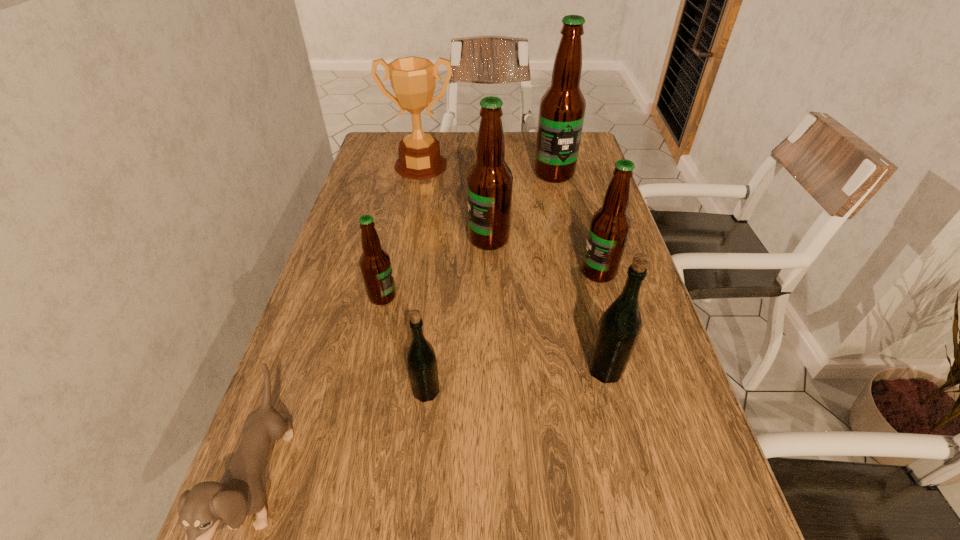
The height and width of the screenshot is (540, 960). Find the location of `the farthest beer bottle`. the farthest beer bottle is located at coordinates (562, 108).

You are a GUI agent. You are given a task and a screenshot of the screen. Output one action in this format:
    pyautogui.click(x=<x>, y=<y>)
    Task: Click on the biggest brown beer bottle
    
    Given the screenshot: What is the action you would take?
    pyautogui.click(x=562, y=108)

At what (x,y) coordinates should I click in order to perform the action: click on the third smallest brown beer bottle. Please return your answer as a coordinate pair (x, y). This screenshot has height=540, width=960. Looking at the image, I should click on (489, 181).

At what (x,y) coordinates should I click in order to perform the action: click on the fifth shortest beer bottle. Please return your answer as a coordinate pair (x, y). The height and width of the screenshot is (540, 960). Looking at the image, I should click on (489, 181).

Image resolution: width=960 pixels, height=540 pixels. Identify the location of award. (413, 81).

The width and height of the screenshot is (960, 540). I want to click on the fourth nearest beer bottle, so click(609, 228).

Identify the location of the second nearest brown beer bottle. The width and height of the screenshot is (960, 540). (609, 228).

Where is `the bigger green beer bottle`? the bigger green beer bottle is located at coordinates (618, 329).

This screenshot has height=540, width=960. I want to click on the nearest brown beer bottle, so click(375, 264).

Find the location of a particular element. The image size is (960, 540). the fourth nearest object is located at coordinates (375, 264).